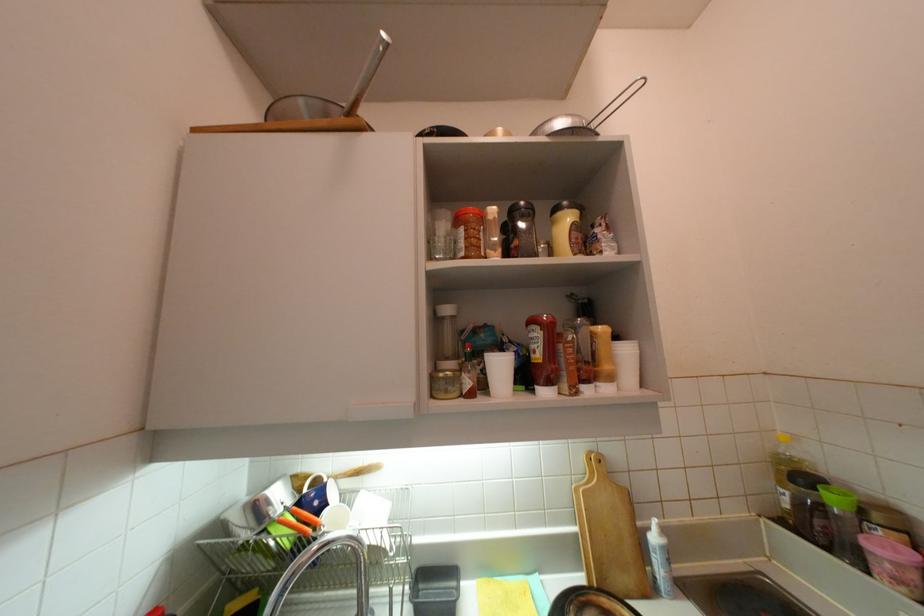
What do you see at coordinates (602, 359) in the screenshot? I see `the yellow mustard bottle` at bounding box center [602, 359].